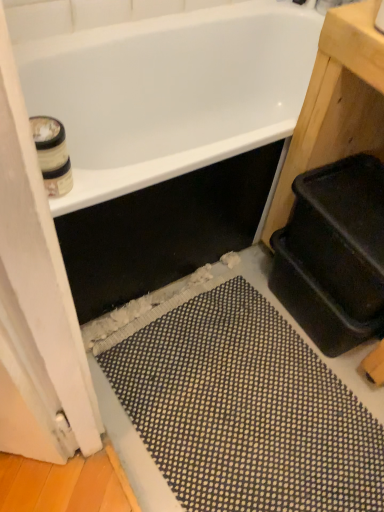
What do you see at coordinates (170, 92) in the screenshot?
I see `white glossy bathtub at upper center` at bounding box center [170, 92].

What is the approximate height of white glossy bathtub at upper center?

The height of white glossy bathtub at upper center is 21.51 inches.

Identify the location of white wood screen door at left. (36, 303).

Locate an element on the screen. This screenshot has height=512, width=384. black rubber bath mat at lower center is located at coordinates (239, 409).

Is white wood screen door at left taller than white glossy bathtub at upper center?

Yes, white wood screen door at left is taller than white glossy bathtub at upper center.

Identify the location of bathtub that is on the right side of white wood screen door at left. This screenshot has width=384, height=512. (170, 92).

Choose the correct answer: Is white wood screen door at left inside white glossy bathtub at upper center or outside it?

white wood screen door at left is not inside white glossy bathtub at upper center, it's outside.

Could you tell me if white wood screen door at left is facing white glossy bathtub at upper center?

No, white wood screen door at left is not oriented towards white glossy bathtub at upper center.

Is white glossy bathtub at upper center not inside white cardboard toilet paper at upper left?

Indeed, white glossy bathtub at upper center is completely outside white cardboard toilet paper at upper left.

Considering the points (195, 57) and (47, 145), which point is in front, point (195, 57) or point (47, 145)?

The point (47, 145) is in front.

At what (x,y) coordinates should I click in order to perform the action: click on toilet paper on the left side of white glossy bathtub at upper center. Please return your answer as a coordinate pair (x, y). The width and height of the screenshot is (384, 512). Looking at the image, I should click on (52, 155).

Measure the distance between white glossy bathtub at upper center and white cardboard toilet paper at upper left.

The distance of white glossy bathtub at upper center from white cardboard toilet paper at upper left is 31.82 inches.

Which object is thinner, white cardboard toilet paper at upper left or white wood screen door at left?

Thinner between the two is white wood screen door at left.

From a real-world perspective, who is located higher, white cardboard toilet paper at upper left or white wood screen door at left?

white cardboard toilet paper at upper left, from a real-world perspective.

Considering the positions of objects white cardboard toilet paper at upper left and white wood screen door at left in the image provided, who is more to the left, white cardboard toilet paper at upper left or white wood screen door at left?

Positioned to the left is white cardboard toilet paper at upper left.

Could you tell me if white cardboard toilet paper at upper left is turned towards white wood screen door at left?

Yes, white cardboard toilet paper at upper left faces towards white wood screen door at left.

Between white wood screen door at left and white cardboard toilet paper at upper left, which one is positioned behind?

white cardboard toilet paper at upper left is more distant.

Which of these two, white wood screen door at left or white cardboard toilet paper at upper left, is thinner?

white wood screen door at left.

Which point is more forward, (72, 351) or (41, 119)?

Point (72, 351)

From the image's perspective, is white wood screen door at left under white cardboard toilet paper at upper left?

Correct, white wood screen door at left appears lower than white cardboard toilet paper at upper left in the image.

From a real-world perspective, which is physically below, white glossy bathtub at upper center or black rubber bath mat at lower center?

black rubber bath mat at lower center, from a real-world perspective.

Locate an element on the screen. Image resolution: width=384 pixels, height=512 pixels. bathtub above the black rubber bath mat at lower center (from a real-world perspective) is located at coordinates click(170, 92).

Which is behind, point (212, 80) or point (260, 411)?

The point (212, 80) is farther.

Is white glossy bathtub at upper center bigger or smaller than black rubber bath mat at lower center?

Considering their sizes, white glossy bathtub at upper center takes up more space than black rubber bath mat at lower center.

From the image's perspective, which object appears higher, white glossy bathtub at upper center or white wood screen door at left?

white glossy bathtub at upper center, from the image's perspective.

Between white glossy bathtub at upper center and white wood screen door at left, which one appears on the right side from the viewer's perspective?

From the viewer's perspective, white glossy bathtub at upper center appears more on the right side.

Between point (42, 96) and point (23, 168), which one is positioned in front?

The point (23, 168) is in front.

Is white wood screen door at left completely or partially inside white glossy bathtub at upper center?

No, white wood screen door at left is not a part of white glossy bathtub at upper center.

Does point (55, 122) appear closer or farther from the camera than point (259, 332)?

Point (55, 122) is closer to the camera than point (259, 332).

Is white cardboard toilet paper at upper left not close to black rubber bath mat at lower center?

white cardboard toilet paper at upper left is actually quite close to black rubber bath mat at lower center.

Does white cardboard toilet paper at upper left come behind black rubber bath mat at lower center?

No, it is not.

In order to click on screen door that is on the left side of white glossy bathtub at upper center in this screenshot , I will do pos(36,303).

This screenshot has height=512, width=384. I want to click on toilet paper below the white glossy bathtub at upper center (from the image's perspective), so click(x=52, y=155).

Based on their spatial positions, is white wood screen door at left or white glossy bathtub at upper center further from black rubber bath mat at lower center?

white glossy bathtub at upper center is further to black rubber bath mat at lower center.

From the image, which object appears to be nearer to white wood screen door at left, black rubber bath mat at lower center or white glossy bathtub at upper center?

The object closer to white wood screen door at left is black rubber bath mat at lower center.

Looking at the image, which one is located further to white cardboard toilet paper at upper left, white wood screen door at left or black rubber bath mat at lower center?

The object further to white cardboard toilet paper at upper left is black rubber bath mat at lower center.

Looking at this image, looking at the image, which one is located closer to white cardboard toilet paper at upper left, white wood screen door at left or white glossy bathtub at upper center?

white wood screen door at left is positioned closer to the anchor white cardboard toilet paper at upper left.

Considering their positions, is black rubber bath mat at lower center positioned closer to white cardboard toilet paper at upper left than white wood screen door at left?

Based on the image, white wood screen door at left appears to be nearer to white cardboard toilet paper at upper left.

Which object lies nearer to the anchor point white wood screen door at left, white cardboard toilet paper at upper left or black rubber bath mat at lower center?

white cardboard toilet paper at upper left is closer to white wood screen door at left.

Considering their positions, is white glossy bathtub at upper center positioned closer to black rubber bath mat at lower center than white wood screen door at left?

Among the two, white wood screen door at left is located nearer to black rubber bath mat at lower center.

Estimate the real-world distances between objects in this image. Which object is closer to black rubber bath mat at lower center, white cardboard toilet paper at upper left or white wood screen door at left?

white wood screen door at left lies closer to black rubber bath mat at lower center than the other object.

Where is `screen door between white glossy bathtub at upper center and black rubber bath mat at lower center in the up-down direction`? The width and height of the screenshot is (384, 512). screen door between white glossy bathtub at upper center and black rubber bath mat at lower center in the up-down direction is located at coordinates (36, 303).

Find the location of a particular element. The width and height of the screenshot is (384, 512). screen door that lies between white cardboard toilet paper at upper left and black rubber bath mat at lower center from top to bottom is located at coordinates (36, 303).

Find the location of a particular element. The image size is (384, 512). toilet paper between white wood screen door at left and white glossy bathtub at upper center from front to back is located at coordinates (52, 155).

Identify the location of toilet paper that lies between white glossy bathtub at upper center and black rubber bath mat at lower center from top to bottom. Image resolution: width=384 pixels, height=512 pixels. (52, 155).